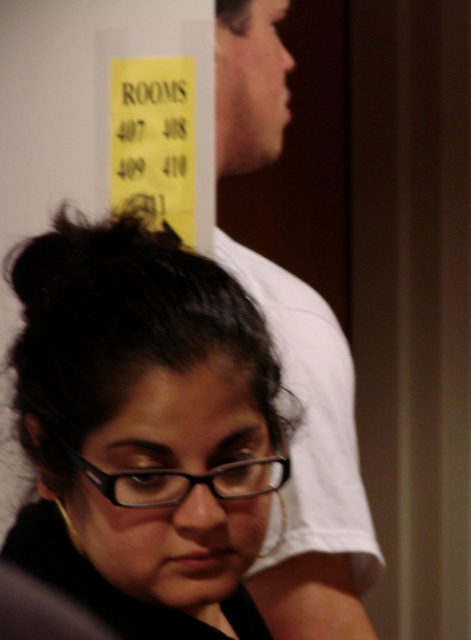
Consider the image. You are a security camera positioned above the entrance. You need to determine if the distance between the black matte hair at center and the white cotton shirt at upper right is sufficient to clearly capture both individuals in a single frame. The camera has a 12.5 inch field of view. Can you capture both in the same frame?

The distance between the black matte hair at center and the white cotton shirt at upper right is 17.63 inches. Since the camera has a 12.5 inch field of view, which is smaller than the distance between them, the camera cannot capture both in the same frame.

You are standing at the point marked by the coordinates point (224, 634) in the image. You want to move forward to the wall with the yellow sign. Is there enough space for you to walk straight ahead without hitting anything?

The point marked by the coordinates point (224, 634) and the viewer are 23.44 inches apart. Since 23.44 inches is less than the typical required space for walking, you might not have enough room to move forward without potentially hitting something.

You are a photographer adjusting your camera to focus on the black matte hair at center and the black plastic glasses at lower center. Which object should you focus on first if you want to capture both clearly in the frame?

The black matte hair at center is above the black plastic glasses at lower center, so you should focus on the black plastic glasses at lower center first to ensure both are in focus since focusing on the closer object first allows the camera to adjust for depth of field.